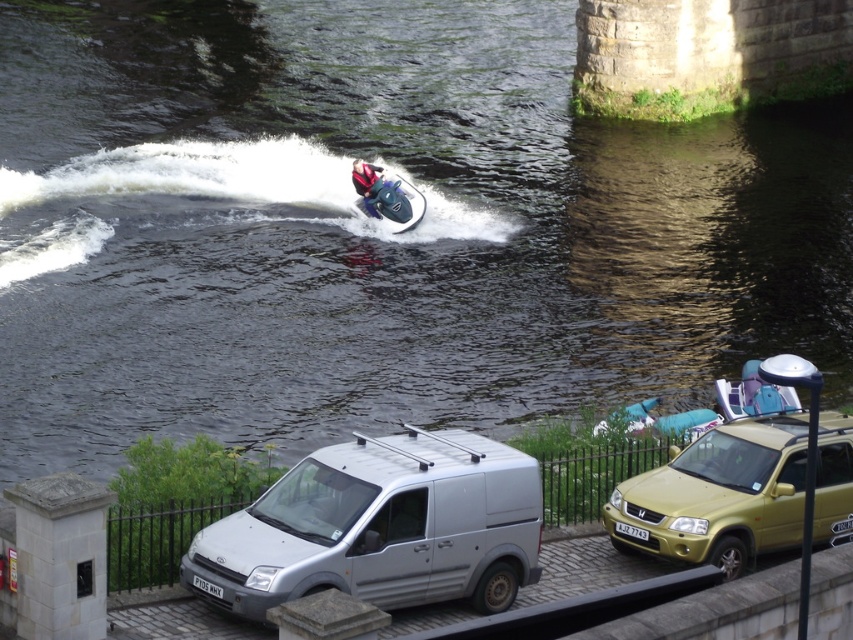
Is point (460, 540) positioned in front of point (383, 177)?

That is True.

Is silver metallic van at lower center positioned before metallic blue jet ski at center?

Yes, silver metallic van at lower center is in front of metallic blue jet ski at center.

Is point (531, 557) in front of point (413, 188)?

Yes, it is in front of point (413, 188).

What are the coordinates of `silver metallic van at lower center` in the screenshot? It's located at (380, 528).

Who is positioned more to the left, gold metallic suv at lower right or metallic blue jet ski at center?

From the viewer's perspective, metallic blue jet ski at center appears more on the left side.

Consider the image. Measure the distance between point (766,545) and camera.

A distance of 20.73 meters exists between point (766,545) and camera.

Where is `gold metallic suv at lower right`? This screenshot has width=853, height=640. gold metallic suv at lower right is located at coordinates tap(718, 497).

Looking at this image, can you confirm if silver metallic van at lower center is positioned to the left of red fabric helmet at upper center?

In fact, silver metallic van at lower center is to the right of red fabric helmet at upper center.

Which is behind, point (532, 499) or point (364, 164)?

Point (364, 164)

Is point (370, 538) behind point (358, 160)?

No, (370, 538) is in front of (358, 160).

Image resolution: width=853 pixels, height=640 pixels. In order to click on silver metallic van at lower center in this screenshot , I will do `click(380, 528)`.